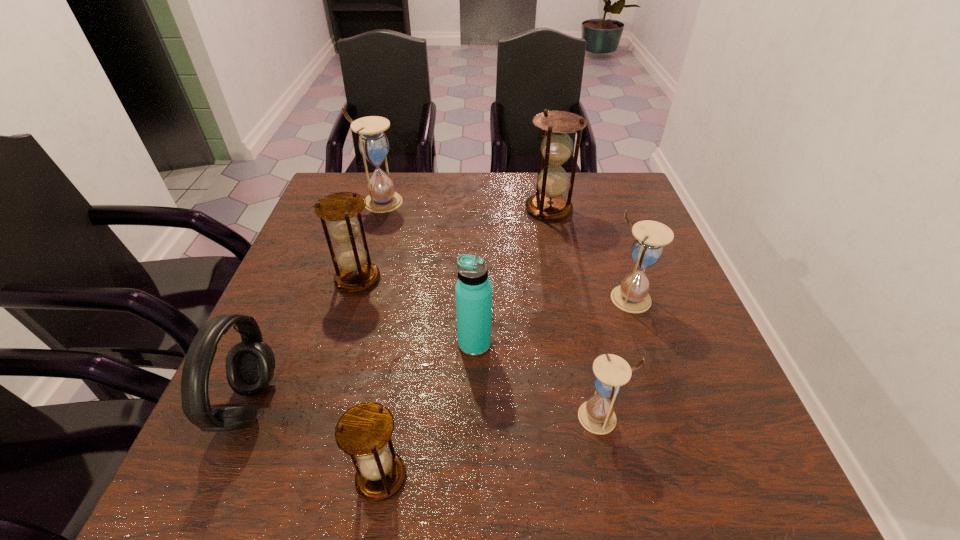
Image resolution: width=960 pixels, height=540 pixels. I want to click on vacant space at the far edge of the desktop, so [483, 176].

This screenshot has height=540, width=960. I want to click on free space at the near edge of the desktop, so click(x=667, y=493).

In the image, there is a desktop. At what (x,y) coordinates should I click in order to perform the action: click on free space at the left edge. Please return your answer as a coordinate pair (x, y). The height and width of the screenshot is (540, 960). Looking at the image, I should click on (283, 327).

Where is `free space at the right edge`? This screenshot has width=960, height=540. free space at the right edge is located at coordinates (665, 309).

The image size is (960, 540). In order to click on vacant space at the near right corner of the desktop in this screenshot , I will do `click(702, 458)`.

The height and width of the screenshot is (540, 960). I want to click on empty space between the farthest brown hourglass and the farthest white hourglass, so click(x=465, y=205).

You are a GUI agent. You are given a task and a screenshot of the screen. Output one action in this format:
    pyautogui.click(x=<x>, y=<y>)
    Task: Click on the vacant space in between the blue water bottle and the fifth object from right to left
    This screenshot has height=540, width=960.
    Given the screenshot: What is the action you would take?
    pyautogui.click(x=428, y=410)

I want to click on vacant space that's between the biggest white hourglass and the smallest brown hourglass, so click(381, 340).

Find the location of a particular element. The image size is (960, 540). vacant space that's between the blue water bottle and the headset is located at coordinates (362, 374).

The width and height of the screenshot is (960, 540). I want to click on free area in between the rightmost white hourglass and the second farthest brown hourglass, so [493, 289].